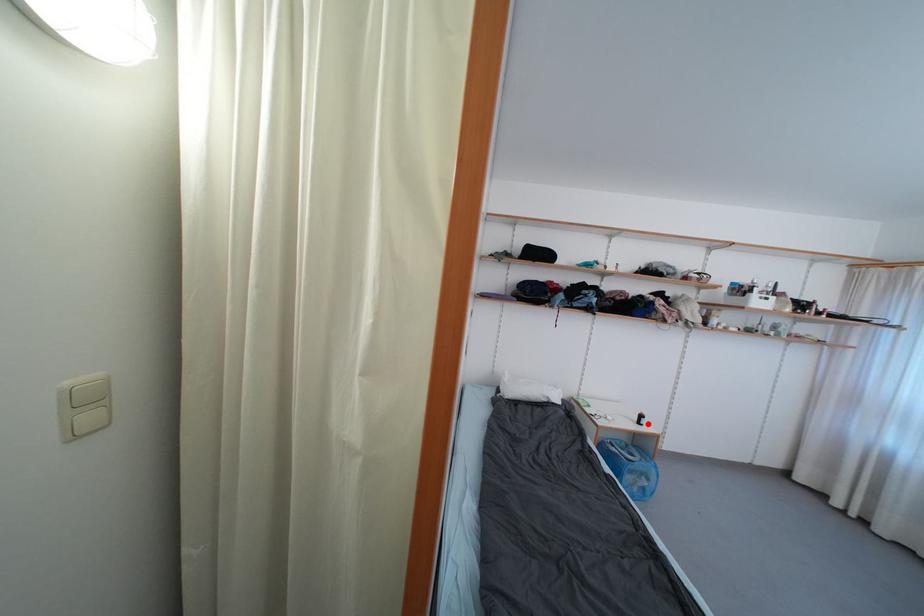
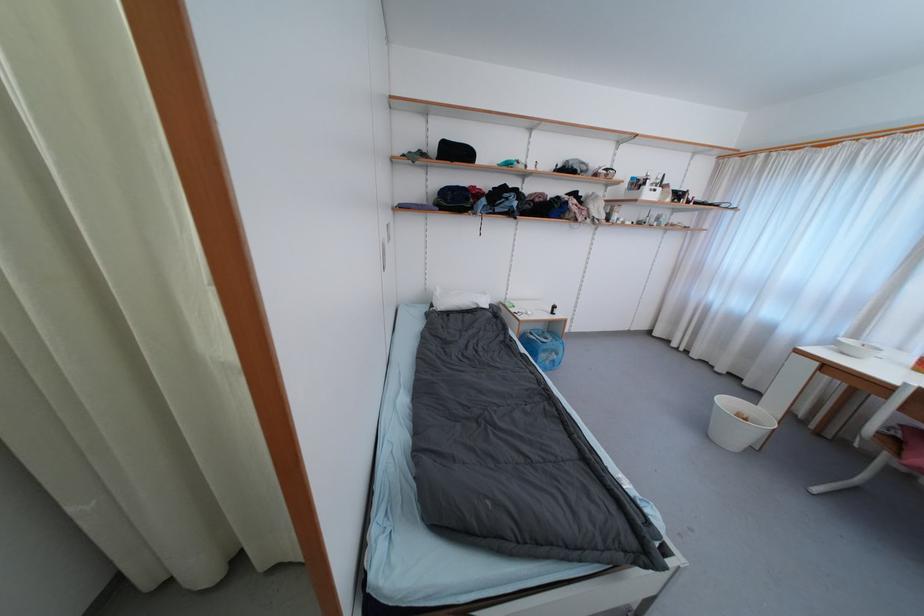
The point at the highlighted location is marked in the first image. Where is the corresponding point in the second image?

(560, 313)